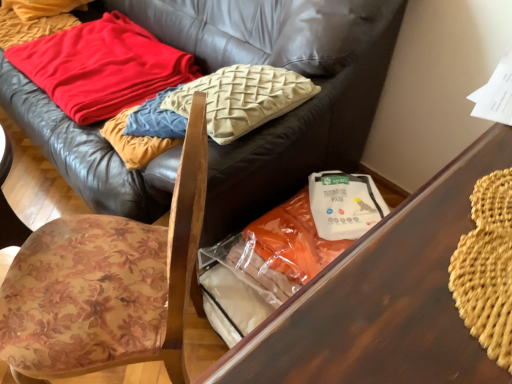
Question: Is leather couch at upper center in front of floral fabric chair at left?

Choices:
 (A) yes
 (B) no

Answer: (B)

Question: Is floral fabric chair at left at the back of leather couch at upper center?

Choices:
 (A) yes
 (B) no

Answer: (B)

Question: Can you confirm if leather couch at upper center is shorter than floral fabric chair at left?

Choices:
 (A) yes
 (B) no

Answer: (A)

Question: Is leather couch at upper center outside floral fabric chair at left?

Choices:
 (A) yes
 (B) no

Answer: (A)

Question: From the image's perspective, does leather couch at upper center appear lower than floral fabric chair at left?

Choices:
 (A) yes
 (B) no

Answer: (B)

Question: From a real-world perspective, relative to red soft fabric blanket at upper left, is floral fabric chair at left vertically above or below?

Choices:
 (A) above
 (B) below

Answer: (A)

Question: In terms of height, does floral fabric chair at left look taller or shorter compared to red soft fabric blanket at upper left?

Choices:
 (A) short
 (B) tall

Answer: (B)

Question: Is floral fabric chair at left in front of or behind red soft fabric blanket at upper left in the image?

Choices:
 (A) front
 (B) behind

Answer: (A)

Question: Based on their positions, is floral fabric chair at left located to the left or right of red soft fabric blanket at upper left?

Choices:
 (A) right
 (B) left

Answer: (A)

Question: Considering the positions of wooden table at center and red soft fabric blanket at upper left in the image, is wooden table at center taller or shorter than red soft fabric blanket at upper left?

Choices:
 (A) tall
 (B) short

Answer: (A)

Question: Looking at their shapes, would you say wooden table at center is wider or thinner than red soft fabric blanket at upper left?

Choices:
 (A) wide
 (B) thin

Answer: (B)

Question: From the image's perspective, is wooden table at center located above or below red soft fabric blanket at upper left?

Choices:
 (A) below
 (B) above

Answer: (A)

Question: Considering their positions, is wooden table at center located in front of or behind red soft fabric blanket at upper left?

Choices:
 (A) front
 (B) behind

Answer: (A)

Question: In the image, is wooden table at center positioned in front of or behind leather couch at upper center?

Choices:
 (A) behind
 (B) front

Answer: (B)

Question: Is wooden table at center spatially inside leather couch at upper center, or outside of it?

Choices:
 (A) outside
 (B) inside

Answer: (A)